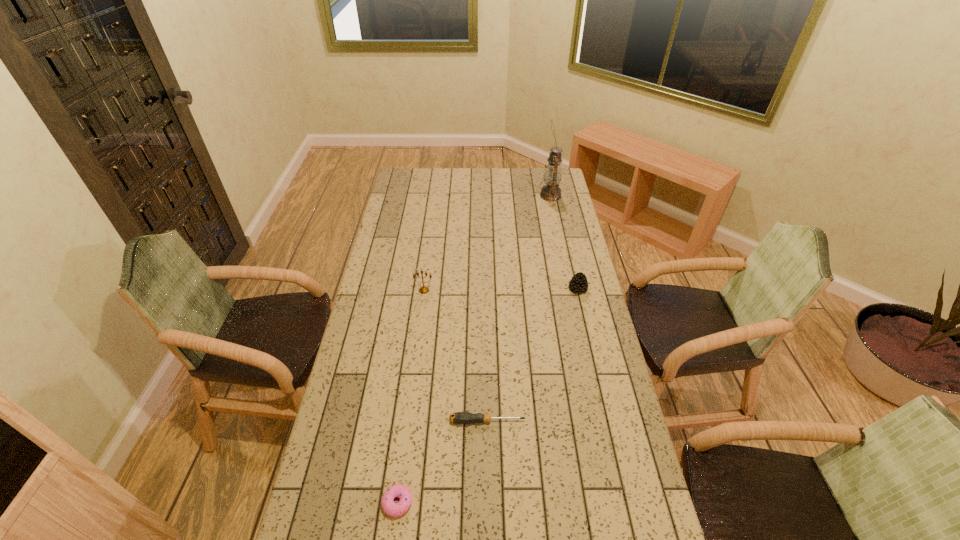
Find the location of a particular element. The image size is (960, 540). unoccupied position between the oil lamp and the nearest object is located at coordinates (474, 349).

This screenshot has width=960, height=540. Identify the location of free space between the third shortest object and the doughnut. (488, 396).

Locate an element on the screen. This screenshot has height=540, width=960. vacant space in between the screwdriver and the doughnut is located at coordinates (443, 462).

Image resolution: width=960 pixels, height=540 pixels. Find the location of `free space between the tallest object and the doughnut`. free space between the tallest object and the doughnut is located at coordinates (474, 349).

Find the location of a particular element. The width and height of the screenshot is (960, 540). vacant area that lies between the farthest object and the second nearest object is located at coordinates (519, 308).

Identify the location of the fourth closest object relative to the pinecone. This screenshot has height=540, width=960. (392, 509).

Locate which object ranks third in proximity to the nearest object. Please provide its 2D coordinates. Your answer should be formatted as a tuple, i.e. [(x, y)], where the tuple contains the x and y coordinates of a point satisfying the conditions above.

[(579, 284)]

Identify the location of free space that satisfies the following two spatial constraints: 1. on the back side of the third object from left to right; 2. on the left side of the doughnut. This screenshot has height=540, width=960. (408, 421).